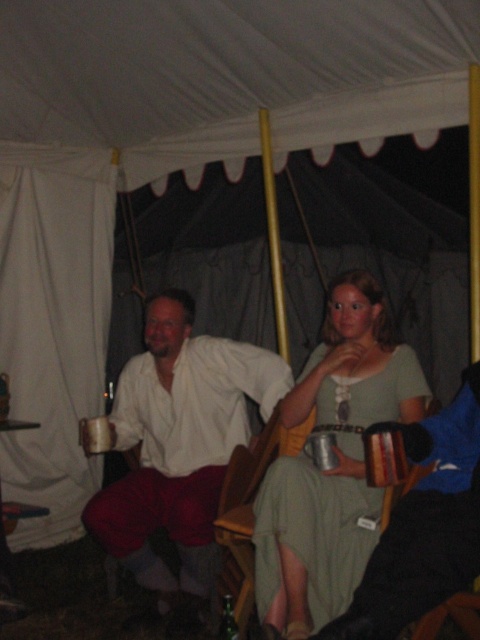
You are a photographer planning to take a group photo of the two people inside the tent. The minimum distance required between subjects for the camera to focus properly is 20 inches. Based on the scene, will the matte green dress at center and the matte white shirt at center be positioned far enough apart for the camera to focus?

The matte green dress at center is 22.28 inches away from the matte white shirt at center, which exceeds the minimum 20 inches required for proper focus. Therefore, the camera should be able to focus on both subjects.

You are standing at the entrance of the tent and want to move towards the point that is closer to the front of the tent. Which point should you head towards, point (357, 538) or point (162, 378)?

Point (357, 538) is in front of point (162, 378), so you should head towards point (357, 538) to reach the front of the tent.